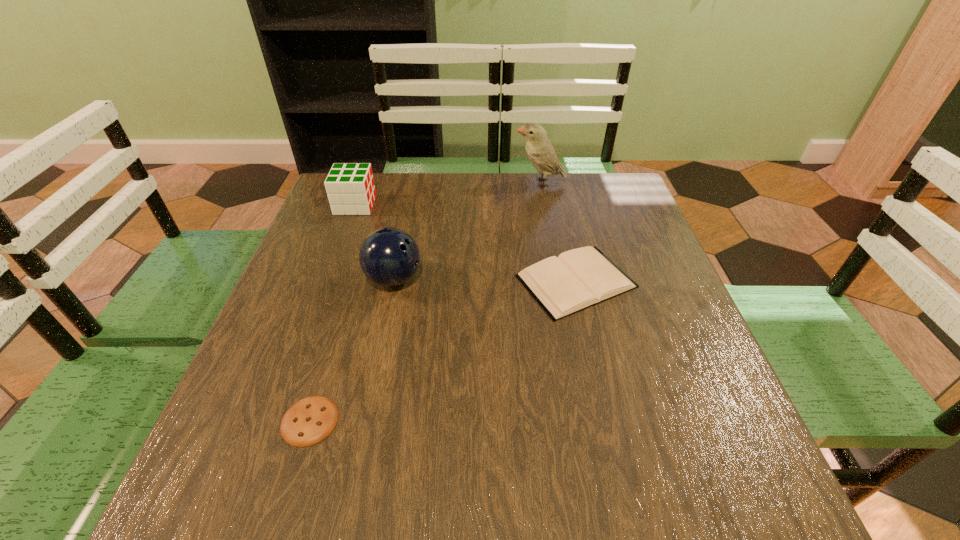
Where is `vacant space in between the hardback book and the second tallest object`? The height and width of the screenshot is (540, 960). vacant space in between the hardback book and the second tallest object is located at coordinates (485, 280).

At what (x,y) coordinates should I click in order to perform the action: click on vacant region between the fourth shortest object and the tallest object. Please return your answer as a coordinate pair (x, y). This screenshot has width=960, height=540. Looking at the image, I should click on [x=467, y=231].

You are a GUI agent. You are given a task and a screenshot of the screen. Output one action in this format:
    pyautogui.click(x=<x>, y=<y>)
    Task: Click on the empty space that is in between the farthest object and the third shortest object
    
    Given the screenshot: What is the action you would take?
    pyautogui.click(x=447, y=194)

Image resolution: width=960 pixels, height=540 pixels. I want to click on free spot between the shortest object and the hardback book, so click(443, 351).

Find the location of a particular element. The height and width of the screenshot is (540, 960). empty location between the nearest object and the third tallest object is located at coordinates (332, 313).

This screenshot has height=540, width=960. I want to click on free point between the nearest object and the second farthest object, so click(x=332, y=313).

Where is `unoccupied position between the fourth shortest object and the second shortest object`? The width and height of the screenshot is (960, 540). unoccupied position between the fourth shortest object and the second shortest object is located at coordinates (485, 280).

Identify the location of the closest object to the nearest object. (389, 257).

Identify the location of the fourth closest object to the hardback book. The width and height of the screenshot is (960, 540). (350, 187).

The image size is (960, 540). Find the location of `free spot that satisfies the following two spatial constraints: 1. on the back side of the shortest object; 2. on the red face of the third shortest object`. free spot that satisfies the following two spatial constraints: 1. on the back side of the shortest object; 2. on the red face of the third shortest object is located at coordinates (375, 205).